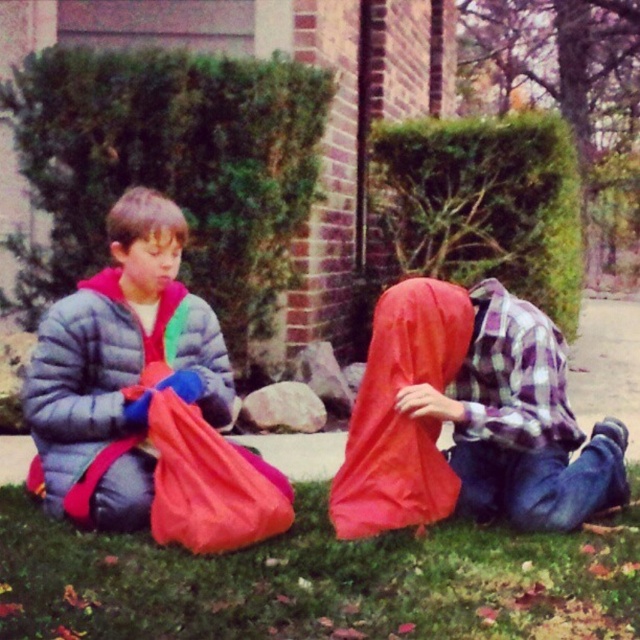
You are a photographer trying to capture a closeup of the matte red plastic bag at lower left without including the matte blue puffer jacket at left in the frame. Based on their positions, is this possible?

The matte blue puffer jacket at left is to the left of the matte red plastic bag at lower left, so moving the camera to the right side of the matte red plastic bag at lower left would exclude the jacket from the frame.

You are a drone operator trying to capture a closeup shot of the matte blue puffer jacket at left and the matte red plastic bag at lower left. The drone has a maximum zoom range that can focus on objects within 5 inches of each other. Can the drone focus on both objects simultaneously?

The distance between the matte blue puffer jacket at left and the matte red plastic bag at lower left is 4.88 inches, which is within the drone operator s 5 inch maximum zoom range. Therefore, the drone can focus on both objects simultaneously.